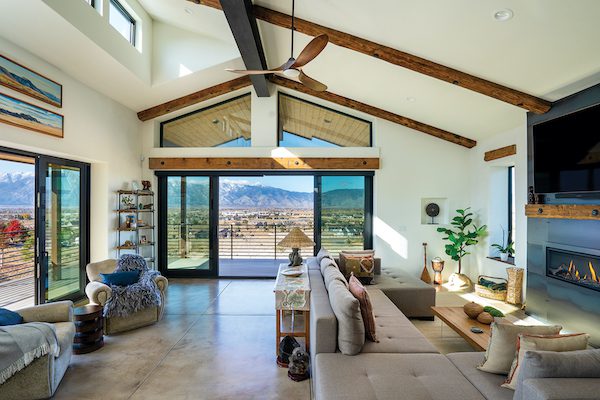
The width and height of the screenshot is (600, 400). In order to click on blanket on chair to the left in this screenshot , I will do `click(138, 289)`.